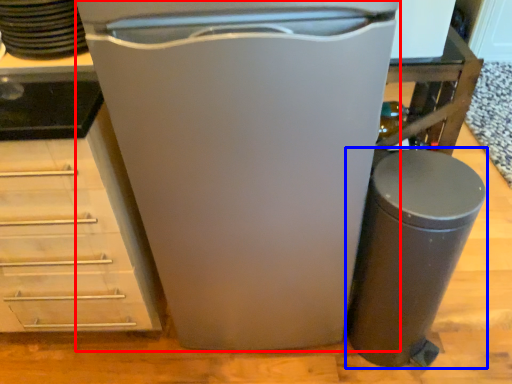
Question: Which point is closer to the camera, home appliance (highlighted by a red box) or waste container (highlighted by a blue box)?

Choices:
 (A) home appliance
 (B) waste container

Answer: (A)